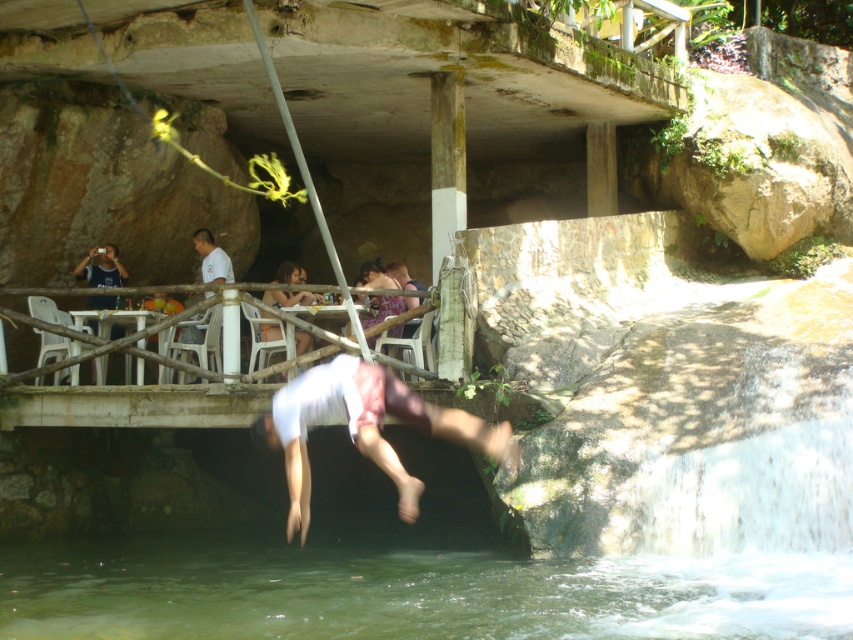
Between point (498, 609) and point (276, 273), which one is positioned behind?

The point (276, 273) is more distant.

Does clear water at lower center appear under matte pink shorts at center?

Yes.

Is point (10, 595) closer to viewer compared to point (279, 300)?

Yes, it is in front of point (279, 300).

Image resolution: width=853 pixels, height=640 pixels. I want to click on clear water at lower center, so [x=410, y=593].

Which is above, clear water at lower center or matte purple dress at center?

Positioned higher is matte purple dress at center.

Can you confirm if clear water at lower center is wider than matte purple dress at center?

Correct, the width of clear water at lower center exceeds that of matte purple dress at center.

Describe the element at coordinates (410, 593) in the screenshot. I see `clear water at lower center` at that location.

The width and height of the screenshot is (853, 640). I want to click on clear water at lower center, so click(x=410, y=593).

Can you confirm if matte pink shorts at center is positioned above matte purple dress at center?

No, matte pink shorts at center is not above matte purple dress at center.

Between matte pink shorts at center and matte purple dress at center, which one has more height?

Standing taller between the two is matte purple dress at center.

Does point (264, 333) lie in front of point (390, 304)?

Yes, point (264, 333) is closer to viewer.

At what (x,y) coordinates should I click in order to perform the action: click on matte pink shorts at center. Please return your answer as a coordinate pair (x, y). Looking at the image, I should click on click(x=287, y=298).